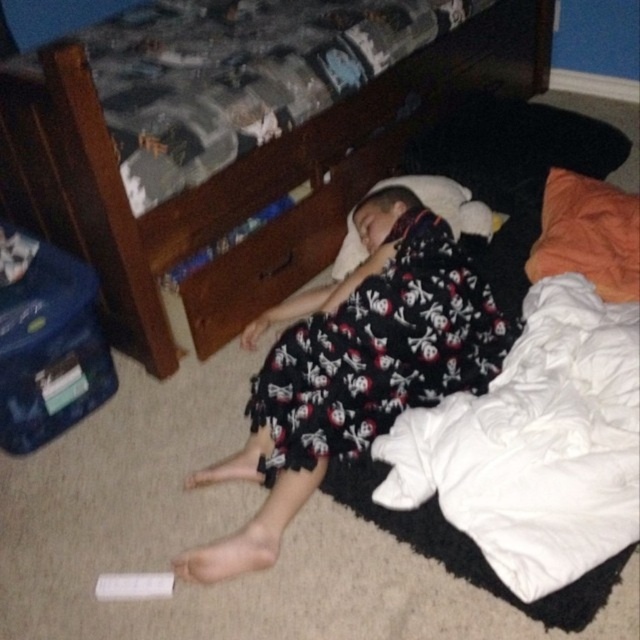
Does wooden bunk bed at upper center appear under white soft pillow at center?

Actually, wooden bunk bed at upper center is above white soft pillow at center.

Which is behind, point (289, 144) or point (404, 186)?

Point (404, 186)

You are a GUI agent. You are given a task and a screenshot of the screen. Output one action in this format:
    pyautogui.click(x=<x>, y=<y>)
    Task: Click on the wooden bunk bed at upper center
    
    Given the screenshot: What is the action you would take?
    pyautogui.click(x=236, y=179)

Describe the element at coordinates (355, 368) in the screenshot. I see `black cotton pajamas at center` at that location.

Can you confirm if black cotton pajamas at center is wider than wooden drawer at center?

Indeed, black cotton pajamas at center has a greater width compared to wooden drawer at center.

Between point (344, 352) and point (275, 291), which one is positioned in front?

Positioned in front is point (344, 352).

Find the location of a particular element. This screenshot has width=640, height=640. black cotton pajamas at center is located at coordinates (355, 368).

Is wooden bunk bed at upper center further to the viewer compared to black cotton pajamas at center?

No, it is in front of black cotton pajamas at center.

Is point (200, 349) positioned before point (244, 547)?

No, (200, 349) is further to viewer.

Where is `wooden bunk bed at upper center`? wooden bunk bed at upper center is located at coordinates (236, 179).